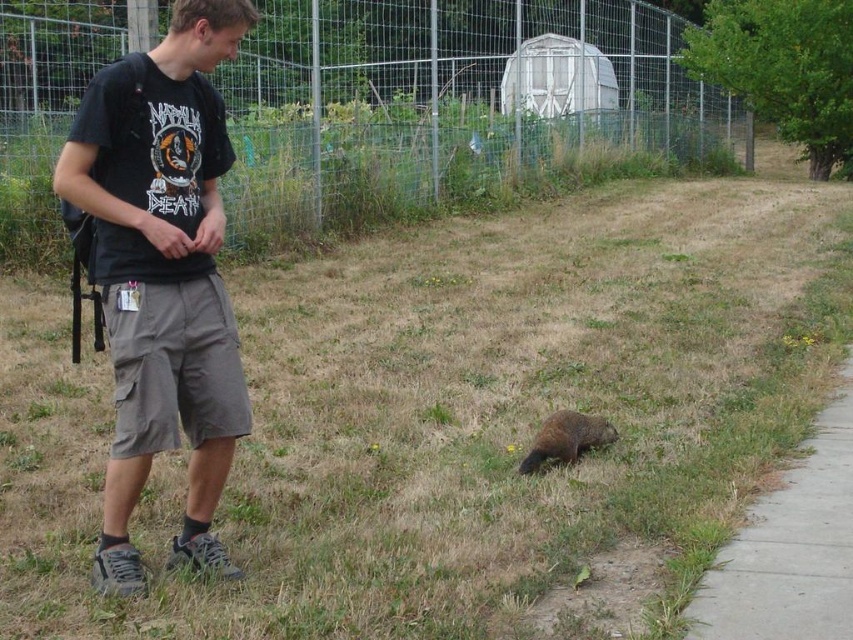
You are standing at the point with coordinates point (532,461) and want to walk to the point (164,179). Which direction should you face to walk towards your destination?

You should face north because point (164,179) is in front of point (532,461), indicating it is north of your current position.

You are a delivery person who needs to walk from the sidewalk to the grassy area. The concrete at lower right and the brown furry groundhog at lower center are in your path. Which direction should you move to avoid stepping on the groundhog?

The concrete at lower right is to the right of the brown furry groundhog at lower center, so you should move to the right side of the groundhog to avoid stepping on it.